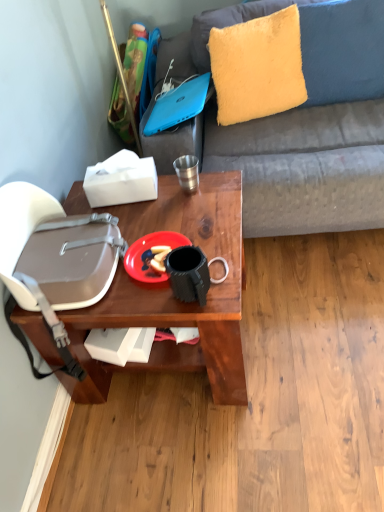
Identify the location of free space above wooden table at center (from a real-world perspective). This screenshot has width=384, height=512. (155, 227).